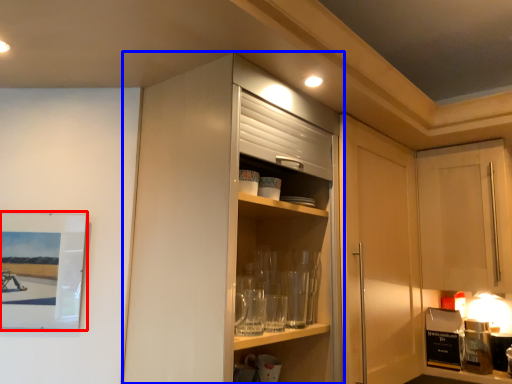
Question: Among these objects, which one is nearest to the camera, picture frame (highlighted by a red box) or cabinetry (highlighted by a blue box)?

Choices:
 (A) picture frame
 (B) cabinetry

Answer: (B)